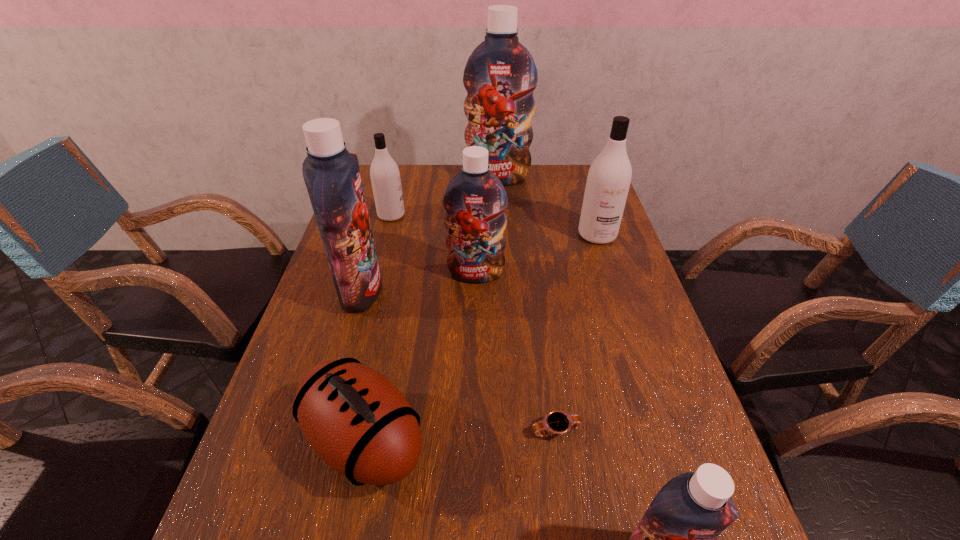
Locate an element on the screen. The width and height of the screenshot is (960, 540). the second shortest object is located at coordinates (356, 420).

This screenshot has width=960, height=540. Identify the location of the shortest object. (555, 422).

Image resolution: width=960 pixels, height=540 pixels. I want to click on watch, so pyautogui.click(x=555, y=422).

Where is `vacant space located on the front label of the farthest object`? vacant space located on the front label of the farthest object is located at coordinates (499, 199).

Where is `vacant space located 0.220m on the front label of the seventh shortest object`? The height and width of the screenshot is (540, 960). vacant space located 0.220m on the front label of the seventh shortest object is located at coordinates (466, 291).

Where is `free space located 0.290m on the front-facing side of the bigger white shampoo`? Image resolution: width=960 pixels, height=540 pixels. free space located 0.290m on the front-facing side of the bigger white shampoo is located at coordinates (625, 320).

Where is `blank space located 0.170m on the front label of the third biggest blue shampoo`? The width and height of the screenshot is (960, 540). blank space located 0.170m on the front label of the third biggest blue shampoo is located at coordinates (475, 333).

At what (x,y) coordinates should I click in order to perform the action: click on free spot located 0.150m on the front-facing side of the second farthest object. Please return your answer as a coordinate pair (x, y). The image size is (960, 540). Looking at the image, I should click on (452, 215).

Where is `blank area located 0.150m on the right of the brown football (American)`? blank area located 0.150m on the right of the brown football (American) is located at coordinates (505, 440).

Identify the location of vacant area situated 0.090m on the back of the shortest object. (549, 381).